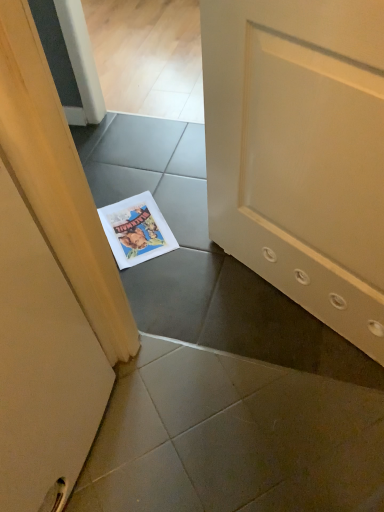
Question: Is the depth of white paper comic book at center greater than that of wooden door at left?

Choices:
 (A) yes
 (B) no

Answer: (A)

Question: From the image's perspective, is white paper comic book at center above wooden door at left?

Choices:
 (A) yes
 (B) no

Answer: (A)

Question: Is white paper comic book at center not within wooden door at left?

Choices:
 (A) yes
 (B) no

Answer: (A)

Question: Is the depth of white paper comic book at center less than that of wooden door at left?

Choices:
 (A) yes
 (B) no

Answer: (B)

Question: Can you confirm if white paper comic book at center is smaller than wooden door at left?

Choices:
 (A) yes
 (B) no

Answer: (A)

Question: From a real-world perspective, is white paper comic book at center under wooden door at left?

Choices:
 (A) no
 (B) yes

Answer: (B)

Question: Does wooden door at left touch white paper comic book at center?

Choices:
 (A) no
 (B) yes

Answer: (A)

Question: Does wooden door at left have a larger size compared to white paper comic book at center?

Choices:
 (A) yes
 (B) no

Answer: (A)

Question: Is there a large distance between wooden door at left and white paper comic book at center?

Choices:
 (A) yes
 (B) no

Answer: (B)

Question: Considering the relative sizes of wooden door at left and white paper comic book at center in the image provided, is wooden door at left taller than white paper comic book at center?

Choices:
 (A) no
 (B) yes

Answer: (B)

Question: Is white paper comic book at center at the back of wooden door at left?

Choices:
 (A) yes
 (B) no

Answer: (B)

Question: From the image's perspective, is wooden door at left under white paper comic book at center?

Choices:
 (A) no
 (B) yes

Answer: (B)

Question: Do you think wooden door at left is within white paper comic book at center, or outside of it?

Choices:
 (A) outside
 (B) inside

Answer: (A)